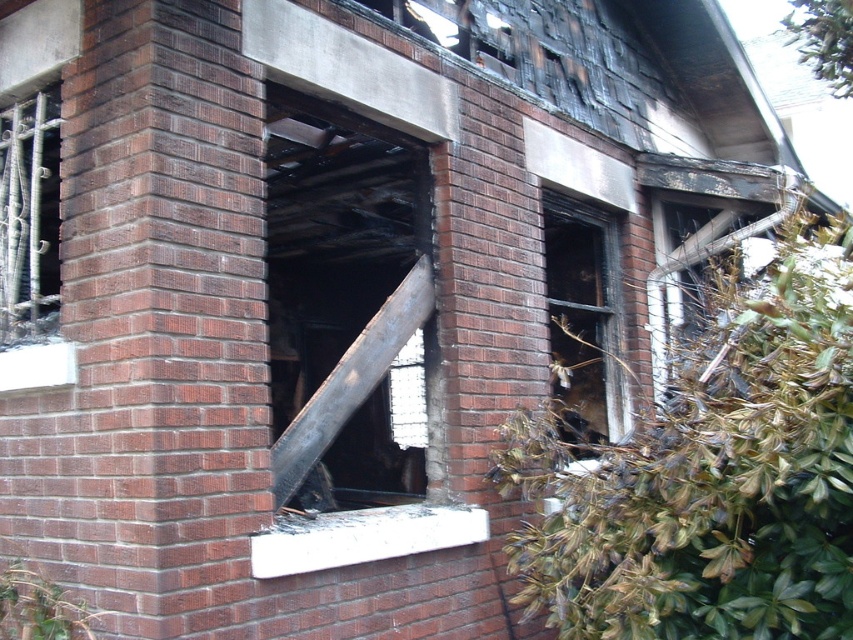
Consider the image. Can you confirm if charcoal wood beam at center is bigger than charcoal wood window at right?

Yes.

At what (x,y) coordinates should I click in order to perform the action: click on charcoal wood beam at center. Please return your answer as a coordinate pair (x, y). The width and height of the screenshot is (853, 640). Looking at the image, I should click on (347, 307).

Does point (370, 132) lie in front of point (691, 256)?

That is True.

Find the location of a particular element. This screenshot has width=853, height=640. charcoal wood beam at center is located at coordinates (347, 307).

Does charcoal wood beam at center appear on the left side of black glass window at center?

Indeed, charcoal wood beam at center is positioned on the left side of black glass window at center.

Does charcoal wood beam at center appear on the right side of black glass window at center?

No, charcoal wood beam at center is not to the right of black glass window at center.

Is point (401, 472) farther from camera compared to point (573, 257)?

Yes, it is.

At what (x,y) coordinates should I click in order to perform the action: click on charcoal wood beam at center. Please return your answer as a coordinate pair (x, y). This screenshot has width=853, height=640. Looking at the image, I should click on (347, 307).

Which of these two, black glass window at center or charcoal wood window at right, stands shorter?

With less height is charcoal wood window at right.

Is black glass window at center bigger than charcoal wood window at right?

Correct, black glass window at center is larger in size than charcoal wood window at right.

Between point (607, 300) and point (780, 202), which one is positioned in front?

Point (780, 202)

The height and width of the screenshot is (640, 853). Find the location of `black glass window at center`. black glass window at center is located at coordinates (584, 320).